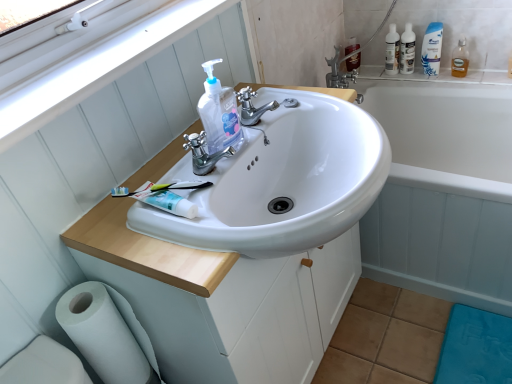
Identify the location of vacant space positioned to the left of clear plastic hand soap at center, which is the first cleaning product in front-to-back order. The image size is (512, 384). 145,173.